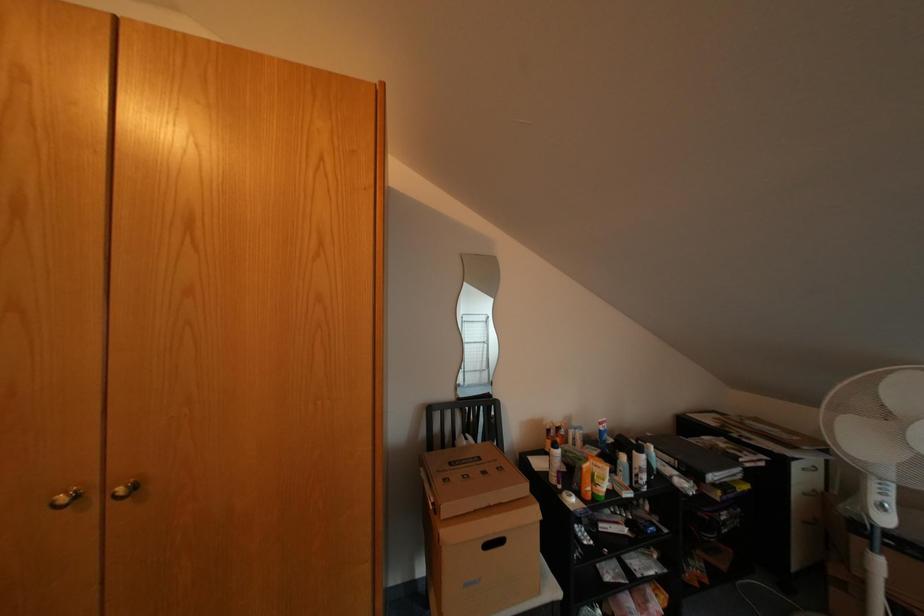
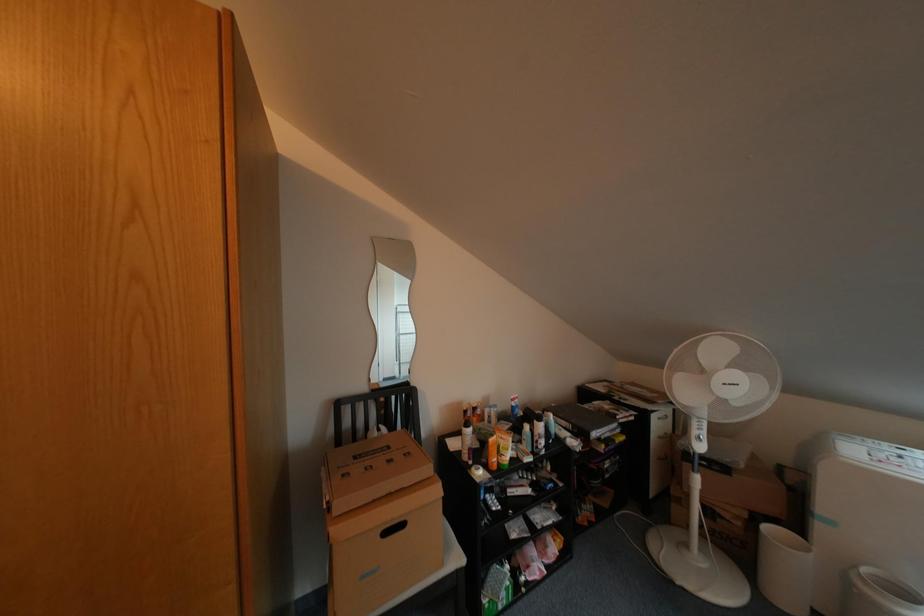
Question: The first image is from the beginning of the video and the second image is from the end. How did the camera likely rotate when shooting the video?

Choices:
 (A) Left
 (B) Right
 (C) Up
 (D) Down

Answer: (B)